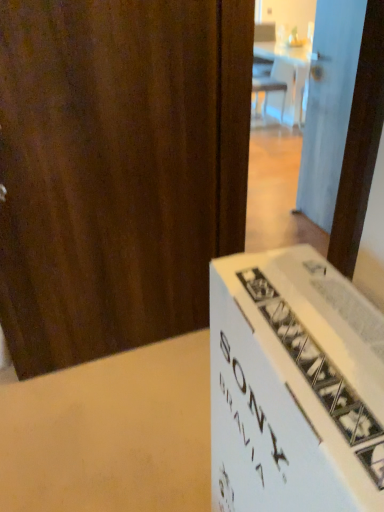
Question: In terms of width, does white glossy door at upper right, which is the second door from front to back, look wider or thinner when compared to wooden door at left, placed as the 1th door when sorted from front to back?

Choices:
 (A) wide
 (B) thin

Answer: (B)

Question: Considering the positions of point (347, 58) and point (74, 287), is point (347, 58) closer or farther from the camera than point (74, 287)?

Choices:
 (A) farther
 (B) closer

Answer: (A)

Question: In the image, is white glossy door at upper right, the 1th door in the back-to-front sequence, on the left side or the right side of wooden door at left, the second door in the back-to-front sequence?

Choices:
 (A) right
 (B) left

Answer: (A)

Question: Considering the positions of wooden door at left, which is the first door in left-to-right order, and white glossy door at upper right, which is the second door from front to back, in the image, is wooden door at left, which is the first door in left-to-right order, wider or thinner than white glossy door at upper right, which is the second door from front to back,?

Choices:
 (A) wide
 (B) thin

Answer: (A)

Question: From their relative heights in the image, would you say wooden door at left, which is the first door in left-to-right order, is taller or shorter than white glossy door at upper right, the 2th door viewed from the left?

Choices:
 (A) short
 (B) tall

Answer: (B)

Question: Is point (226, 14) positioned closer to the camera than point (326, 28)?

Choices:
 (A) farther
 (B) closer

Answer: (B)

Question: From the image's perspective, is wooden door at left, the second door when ordered from right to left, located above or below white glossy door at upper right, the 2th door viewed from the left?

Choices:
 (A) above
 (B) below

Answer: (B)